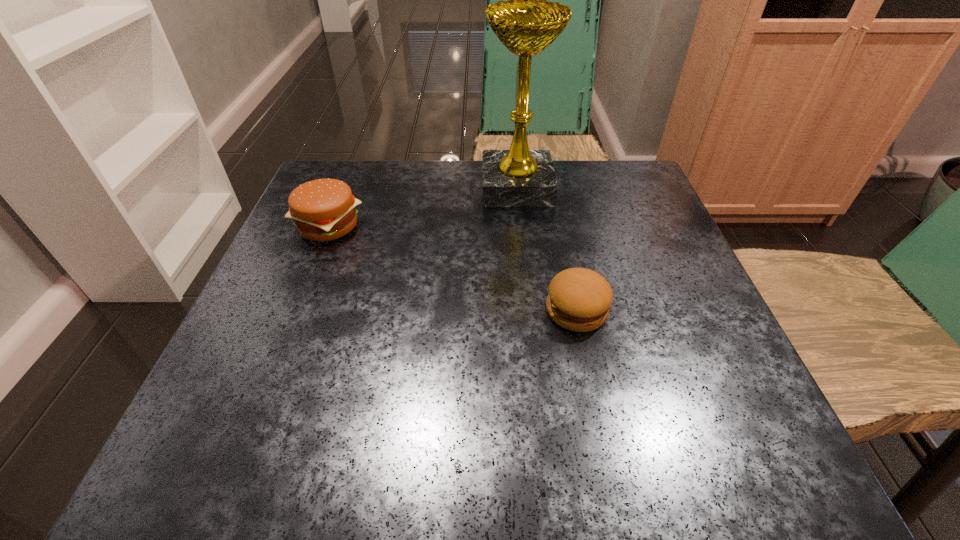
I want to click on vacant area between the tallest object and the shortest object, so click(x=546, y=249).

Identify the location of unoccupied area between the tallest object and the right hamburger. (x=546, y=249).

This screenshot has width=960, height=540. I want to click on vacant area that lies between the shortest object and the tallest object, so click(x=546, y=249).

In order to click on unoccupied position between the tallest object and the shorter hamburger in this screenshot , I will do `click(546, 249)`.

Locate an element on the screen. This screenshot has height=540, width=960. free space between the award and the leftmost object is located at coordinates click(422, 206).

Where is `free area in between the right hamburger and the taller hamburger`? free area in between the right hamburger and the taller hamburger is located at coordinates click(x=452, y=268).

The image size is (960, 540). Find the location of `free space between the right hamburger and the second shortest object`. free space between the right hamburger and the second shortest object is located at coordinates (452, 268).

Locate an element on the screen. The height and width of the screenshot is (540, 960). vacant area that lies between the shorter hamburger and the taller hamburger is located at coordinates (452, 268).

Identify the location of free spot between the award and the second tallest object. (422, 206).

Locate an element on the screen. The height and width of the screenshot is (540, 960). vacant space that's between the right hamburger and the tallest object is located at coordinates (546, 249).